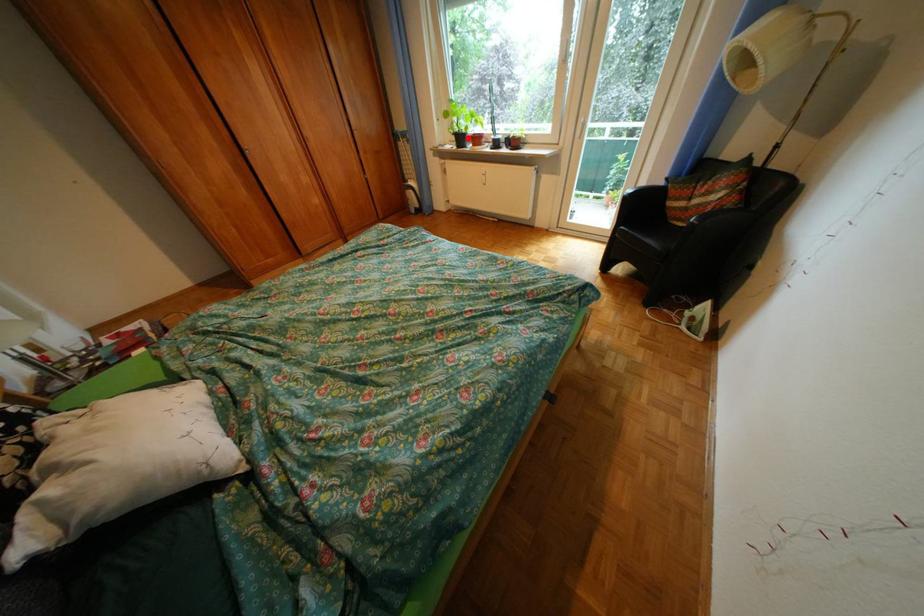
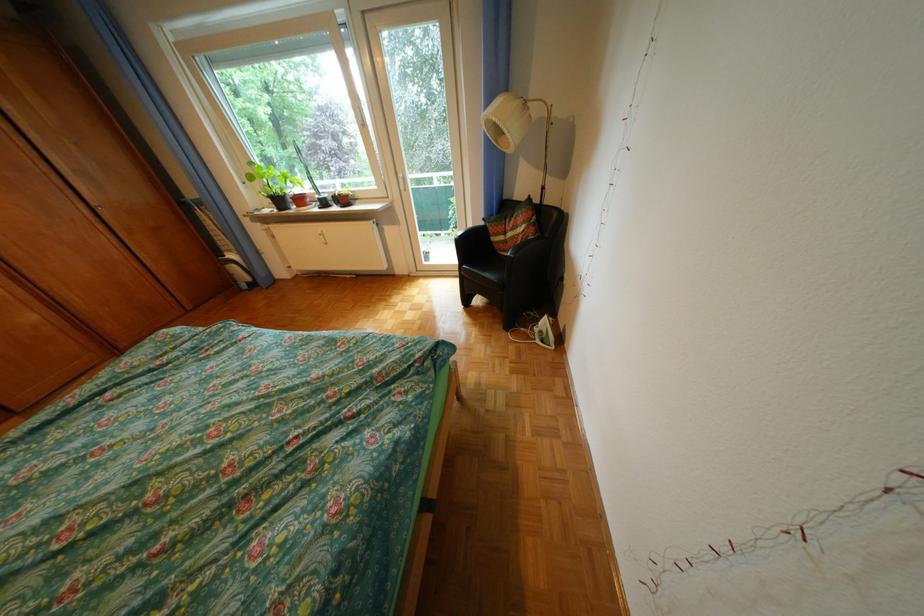
Question: I am providing you with two images of the same scene from different viewpoints. A red point is shown in image1. For the corresponding object point in image2, is it positioned nearer or farther from the camera?

Choices:
 (A) Nearer
 (B) Farther

Answer: (B)